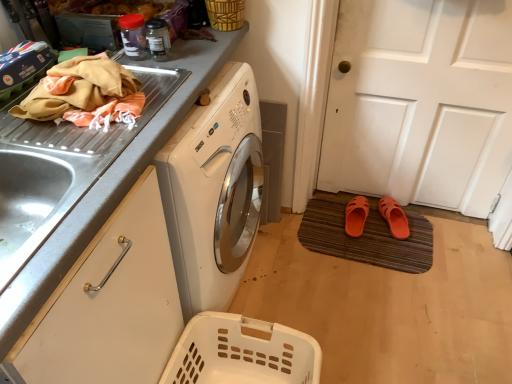
Image resolution: width=512 pixels, height=384 pixels. What are the coordinates of `unoccupied region to the right of orange rubber sandals at lower right, positioned as the 1th footwear in right-to-left order` in the screenshot? It's located at (417, 225).